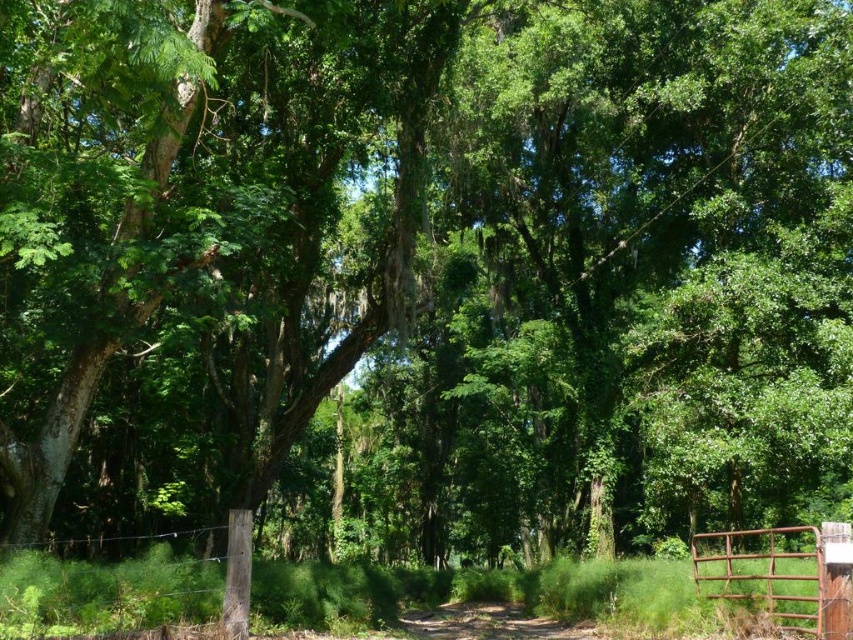
You are standing in the forest and want to exit through the rusty metal gate at lower right. Based on the coordinates provided, is the gate closer to the center of the image or to the edge?

The rusty metal gate at lower right is located at point [782,573], which places it closer to the edge of the image rather than the center. Therefore, the gate is nearer to the edge.

You are a photographer standing in the forest scene. You want to take a photo that includes both the point at (727, 586) and the point at (468, 632). Which point should you focus on first to ensure both are in sharp focus?

You should focus on point (468, 632) first because it is farther from the camera than point (727, 586). By focusing on the farther point, the closer point will also be within the depth of field, ensuring both are in sharp focus.